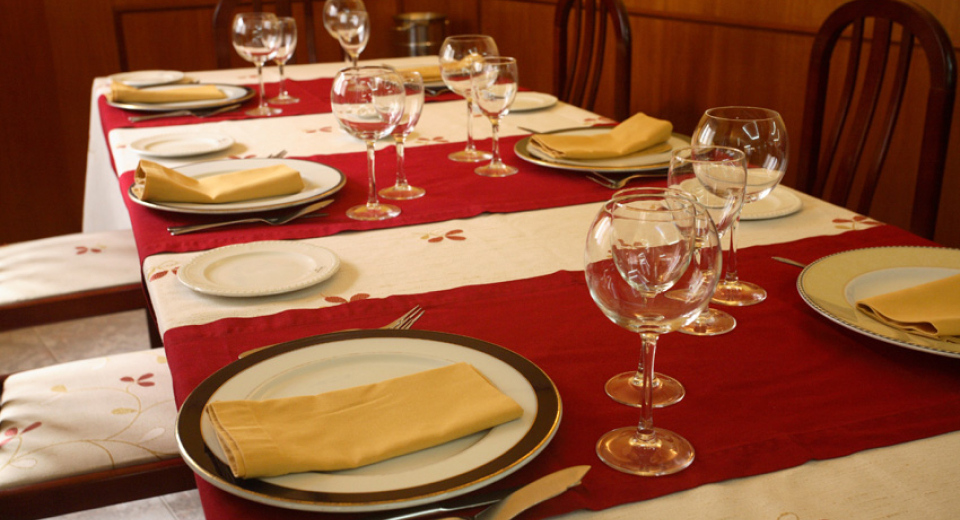
You are a GUI agent. You are given a task and a screenshot of the screen. Output one action in this format:
    pyautogui.click(x=<x>, y=<y>)
    Task: Click on the large dinner plates on table
    
    Given the screenshot: What is the action you would take?
    pyautogui.click(x=337, y=375), pyautogui.click(x=874, y=277), pyautogui.click(x=651, y=159), pyautogui.click(x=319, y=175), pyautogui.click(x=233, y=93), pyautogui.click(x=433, y=84)